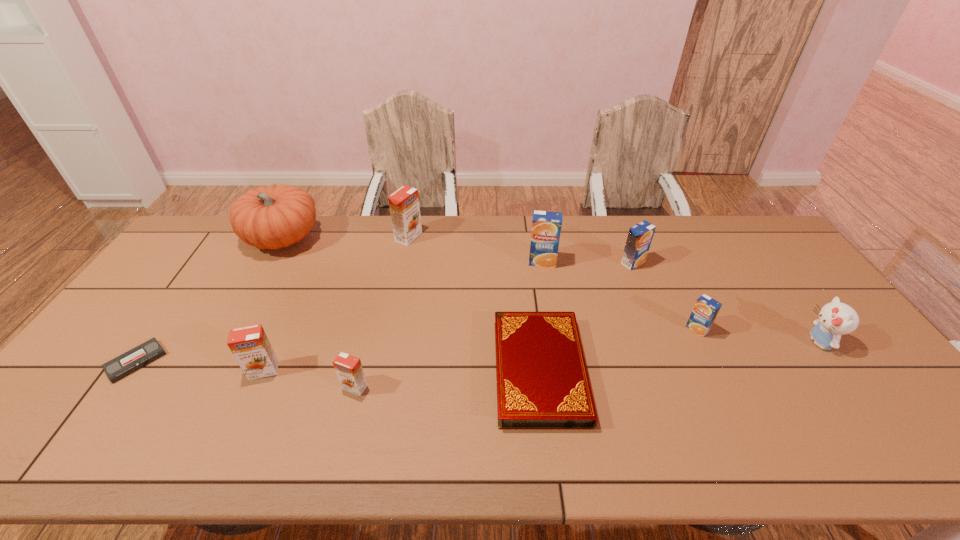
Identify the location of orange pumpkin. (273, 217).

This screenshot has height=540, width=960. I want to click on the farthest orange juice, so coord(404,206).

This screenshot has height=540, width=960. Find the location of `the biggest orange orange juice`. the biggest orange orange juice is located at coordinates (404, 206).

Identify the location of the biggest blue orange_juice. (546, 226).

I want to click on the leftmost blue orange_juice, so click(546, 226).

This screenshot has height=540, width=960. I want to click on the eighth object from left to right, so click(640, 236).

The width and height of the screenshot is (960, 540). In order to click on the second blue orange_juice from right to left in this screenshot , I will do click(x=640, y=236).

Find the location of a particular element. Image resolution: width=960 pixels, height=540 pixels. the leftmost orange orange juice is located at coordinates (250, 346).

Identify the location of the leftmost orange juice. This screenshot has width=960, height=540. (250, 346).

The height and width of the screenshot is (540, 960). What are the coordinates of `the rightmost object` in the screenshot? It's located at (835, 319).